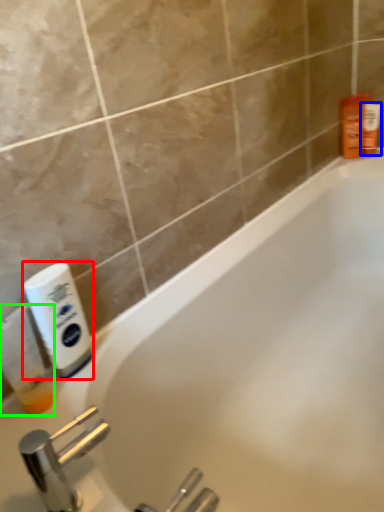
Question: Which is nearer to the cleaning product (highlighted by a red box)? toiletry (highlighted by a blue box) or cleaning product (highlighted by a green box).

Choices:
 (A) toiletry
 (B) cleaning product

Answer: (B)